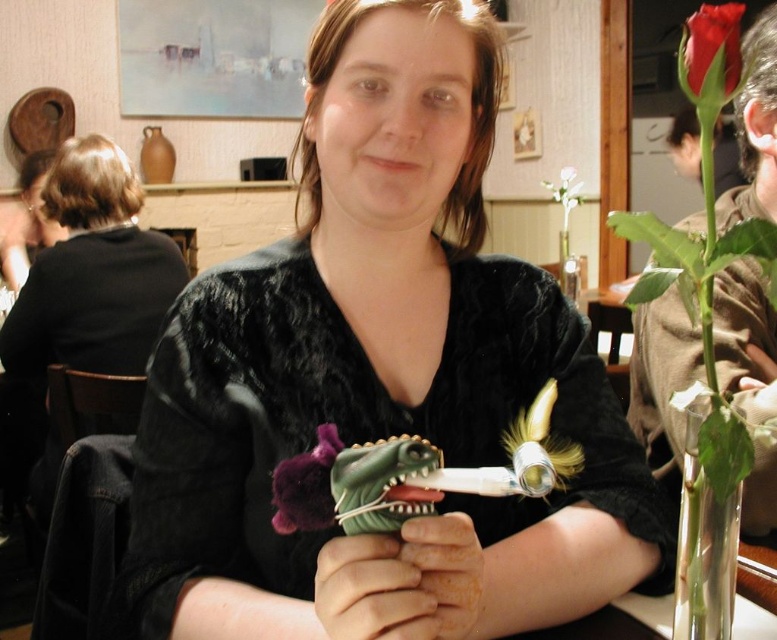
In the scene shown: You are a photographer setting up for a portrait. The velvet black shirt at center and the green matte toy at center are both in the frame. Which object should you focus on first to ensure it is sharp in the final photo?

You should focus on the velvet black shirt at center first because it is closer to the camera than the green matte toy at center, which is behind it.

You are a tailor measuring for a custom shirt. You observe the velvet black shirt at center and the green matte toy at center in the scene. Which object is taller?

The velvet black shirt at center is taller than the green matte toy at center.

You are trying to determine which of the two points, point (409, 532) or point (330, 497), is closer to you in the image. Based on the scene description, which point is nearer?

Point (409, 532) is closer to the camera than point (330, 497).